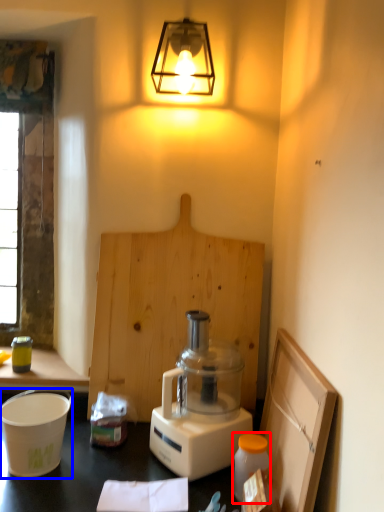
Question: Among these objects, which one is farthest to the camera, bottle (highlighted by a red box) or appliance (highlighted by a blue box)?

Choices:
 (A) bottle
 (B) appliance

Answer: (B)